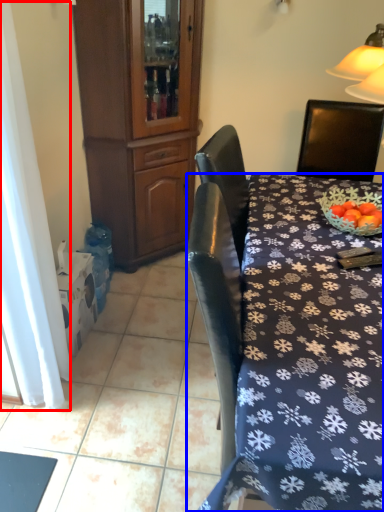
Question: Which of the following is the closest to the observer, curtain (highlighted by a red box) or desk (highlighted by a blue box)?

Choices:
 (A) curtain
 (B) desk

Answer: (B)